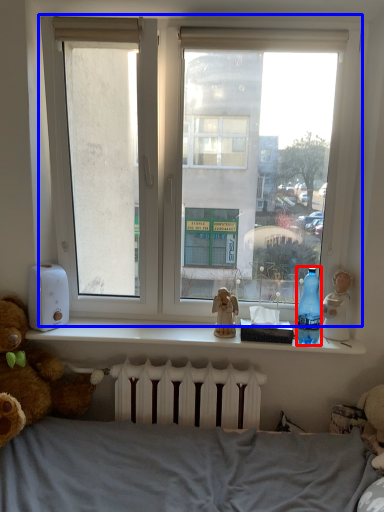
Question: Which of the following is the farthest to the observer, bottle (highlighted by a red box) or window (highlighted by a blue box)?

Choices:
 (A) bottle
 (B) window

Answer: (A)